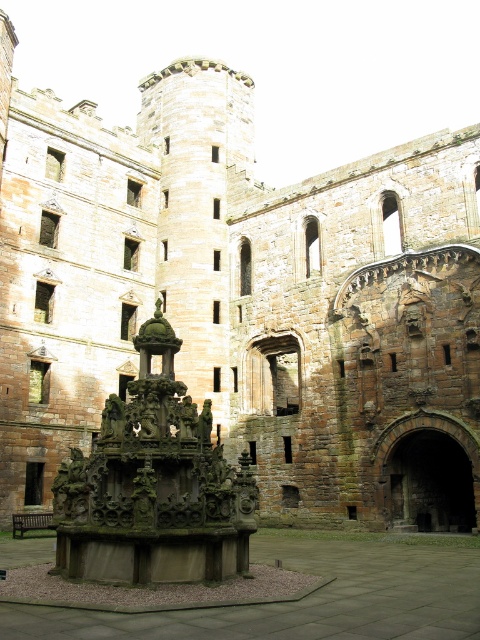
Question: Which point appears farthest from the camera in this image?

Choices:
 (A) (101, 538)
 (B) (330, 620)

Answer: (A)

Question: Can you confirm if dark stone fountain at center is wider than stone fountain at center?

Choices:
 (A) yes
 (B) no

Answer: (B)

Question: Is dark stone fountain at center wider than stone fountain at center?

Choices:
 (A) yes
 (B) no

Answer: (B)

Question: Does dark stone fountain at center appear on the right side of stone fountain at center?

Choices:
 (A) no
 (B) yes

Answer: (A)

Question: Among these objects, which one is nearest to the camera?

Choices:
 (A) dark stone fountain at center
 (B) stone fountain at center

Answer: (B)

Question: Which point is closer to the camera?

Choices:
 (A) stone fountain at center
 (B) dark stone fountain at center

Answer: (A)